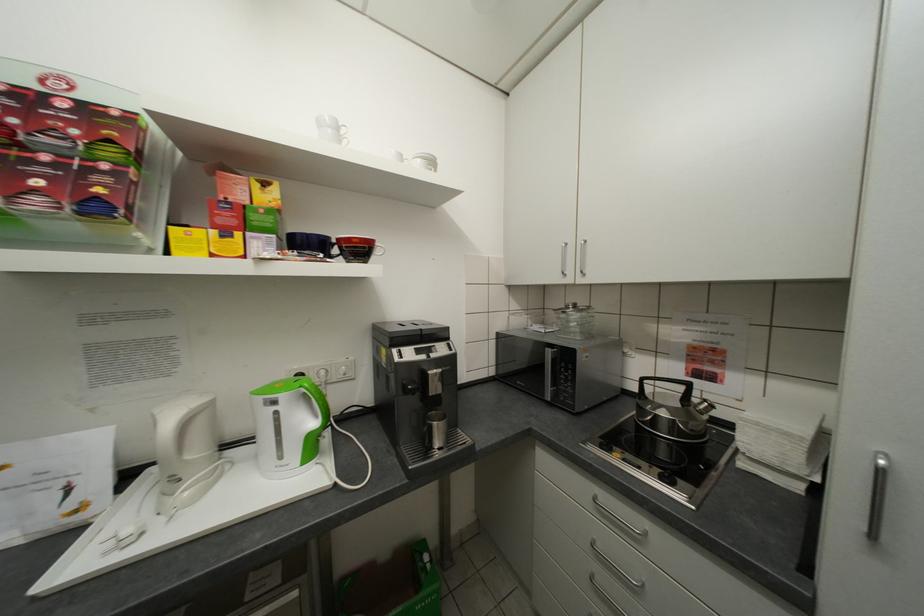
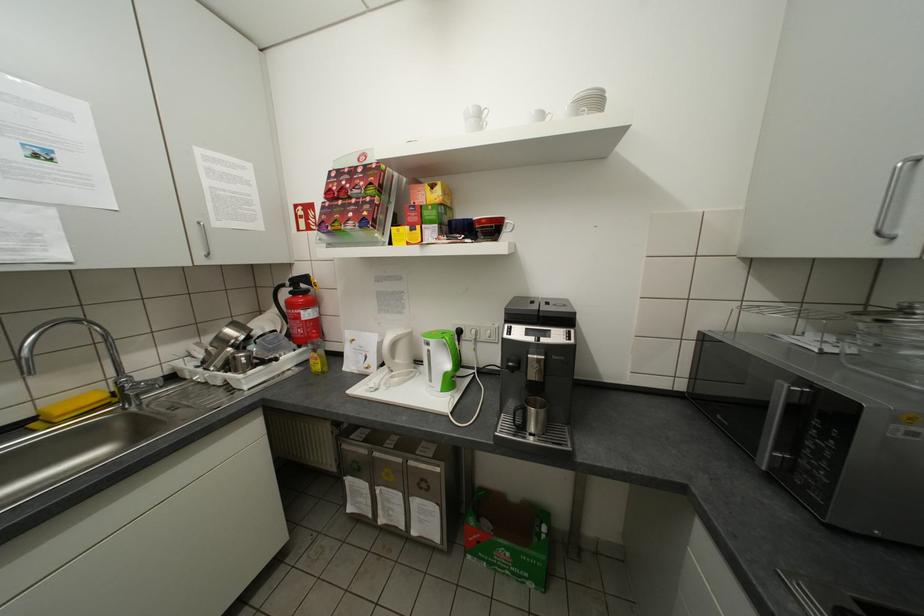
Find the pixel in the second image that matches [446,443] in the first image.

(541, 428)